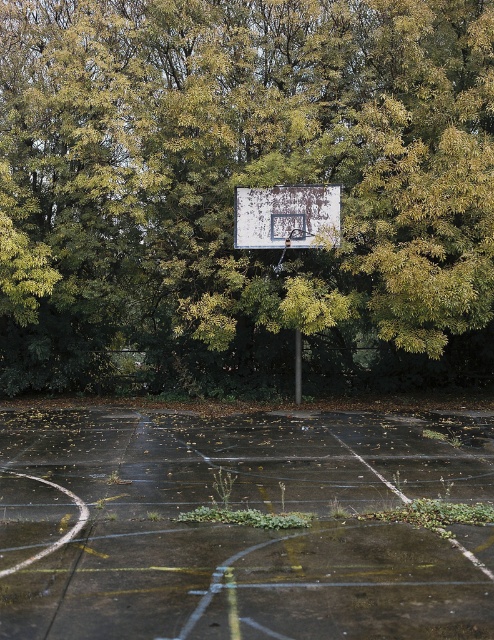
You are a photographer wanting to capture the basketball court with both the green leafy tree at upper center and the white painted metal basketball backboard at center in your shot. Based on their positions, which object should you frame first to ensure both are visible in the photo?

The green leafy tree at upper center is positioned on the left side of the white painted metal basketball backboard at center, so you should frame the white painted metal basketball backboard at center first to ensure both are visible in the photo.

You are standing on the basketball court and want to throw a ball to the hoop. There is a green leafy tree at upper center. Where should you aim to avoid hitting the tree?

The green leafy tree at upper center is located at point 0.291 on the x axis and 0.498 on the y axis, so you should aim to the left or right of the tree to avoid it.

You are a maintenance worker assessing the basketball court. You notice the green leafy tree at upper center and the concrete court at center. Which object is taller?

The green leafy tree at upper center is taller than the concrete court at center.